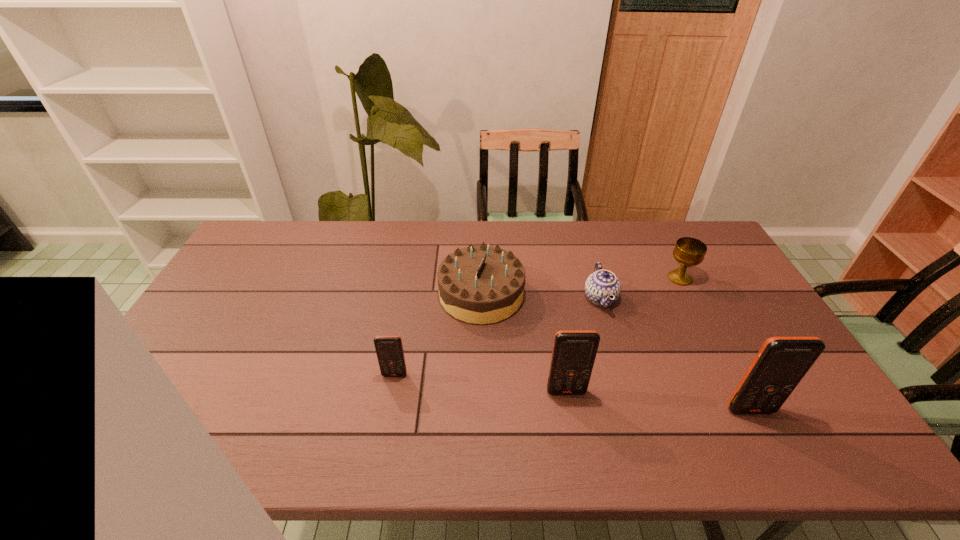
Locate an element on the screen. The height and width of the screenshot is (540, 960). chalice that is positioned at the right edge is located at coordinates (688, 251).

Identify the location of object located in the near right corner section of the desktop. The width and height of the screenshot is (960, 540). (781, 363).

Find the location of a particular element. The image size is (960, 540). vacant region at the far edge of the desktop is located at coordinates (310, 225).

Where is `free region at the near edge`? This screenshot has width=960, height=540. free region at the near edge is located at coordinates (444, 406).

Locate an element on the screen. The height and width of the screenshot is (540, 960). vacant area at the left edge of the desktop is located at coordinates (269, 265).

In the image, there is a desktop. At what (x,y) coordinates should I click in order to perform the action: click on blank space at the right edge. Please return your answer as a coordinate pair (x, y). Looking at the image, I should click on (763, 314).

Locate an element on the screen. blank space at the near left corner is located at coordinates (170, 409).

Identify the location of free space at the far right corner. (705, 230).

Identify the location of vacant space that's between the leftmost object and the chalice. Image resolution: width=960 pixels, height=540 pixels. (537, 327).

You are a GUI agent. You are given a task and a screenshot of the screen. Output one action in this format:
    pyautogui.click(x=<x>, y=<y>)
    Task: Click on the unoccupied position between the shortest object and the nearest object
    Image resolution: width=960 pixels, height=540 pixels.
    Given the screenshot: What is the action you would take?
    pyautogui.click(x=675, y=354)